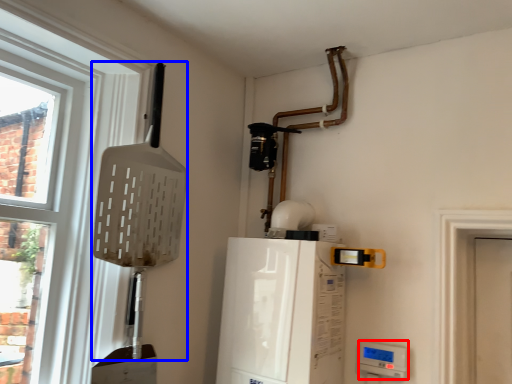
Question: Which of the following is the farthest to the observer, appliance (highlighted by a red box) or shovel (highlighted by a blue box)?

Choices:
 (A) appliance
 (B) shovel

Answer: (A)